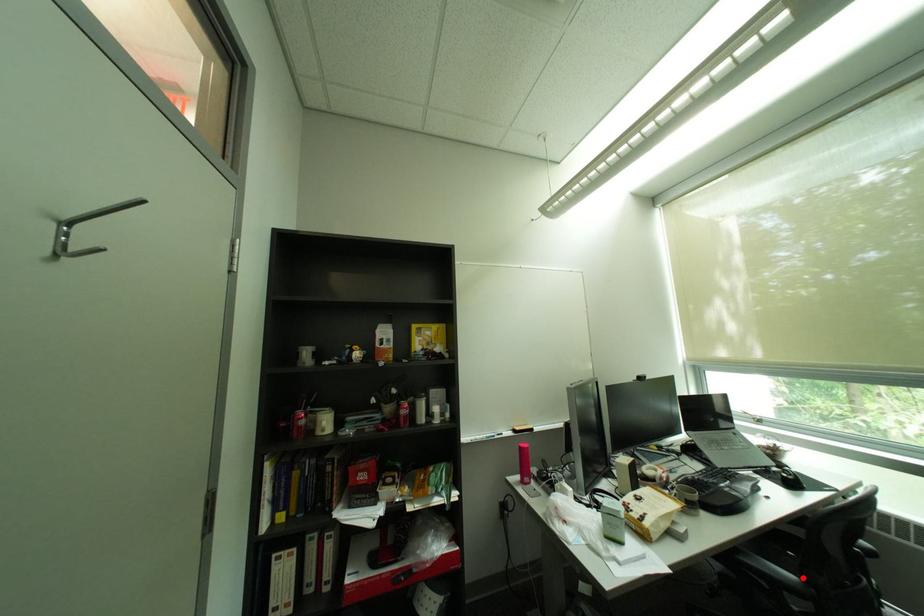
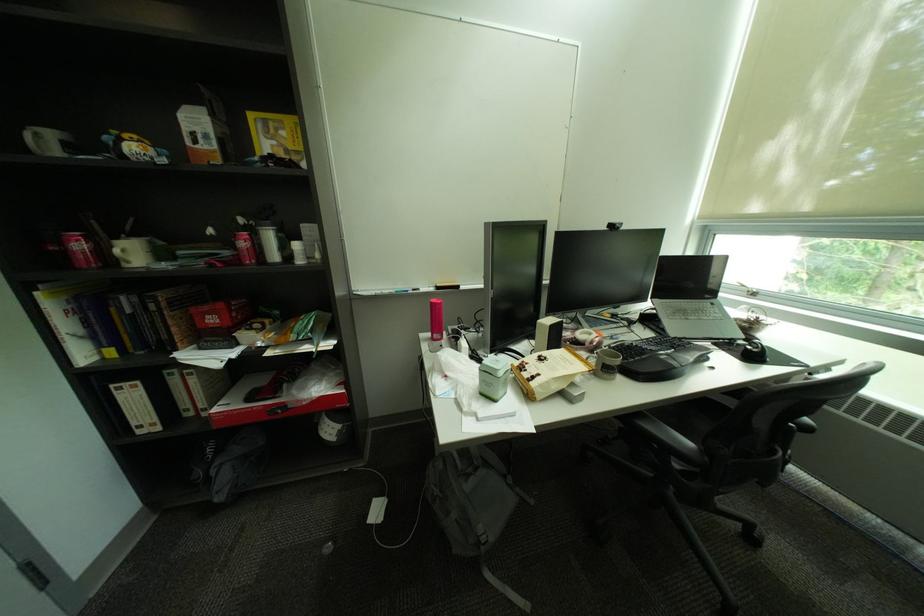
Question: I am providing you with two images of the same scene from different viewpoints. In image1, a red point is highlighted. Considering the same 3D point in image2, which of the following is correct?

Choices:
 (A) It is closer
 (B) It is farther

Answer: (B)